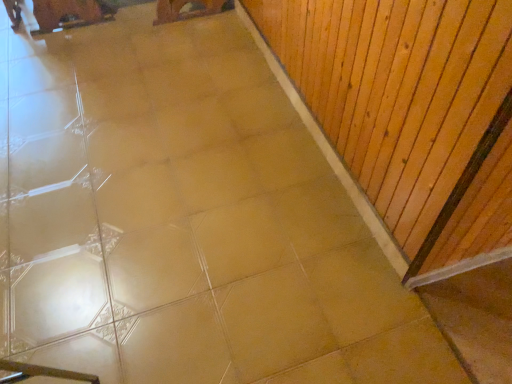
At what (x,y) coordinates should I click in order to perform the action: click on natural wood plywood at upper right. Please return your answer as a coordinate pair (x, y). This screenshot has height=384, width=512. Looking at the image, I should click on (407, 107).

Measure the distance between point (416, 142) and camera.

Point (416, 142) and camera are 3.71 feet apart.

Describe the element at coordinates (407, 107) in the screenshot. I see `natural wood plywood at upper right` at that location.

Where is `natural wood plywood at upper right`? The image size is (512, 384). natural wood plywood at upper right is located at coordinates (407, 107).